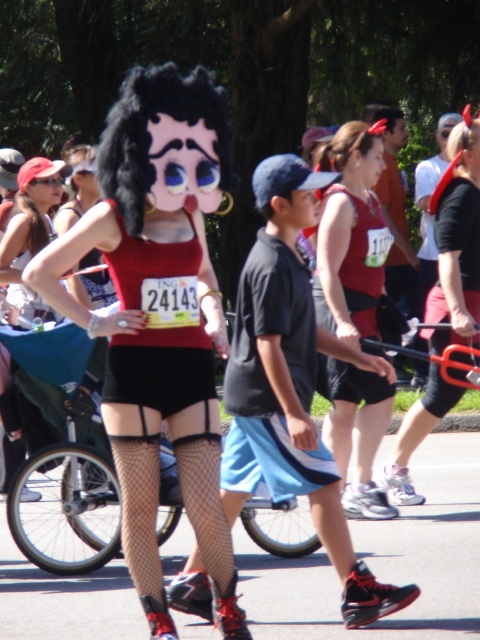
You are standing at the event and want to take a photo of the matte black wig at center. If your camera can focus up to 20 feet away, will you be able to capture it clearly?

The matte black wig at center is 18.37 feet away from the viewer. Since the camera can focus up to 20 feet, it is within range, so yes, you can capture it clearly.

You are a photographer at the event and want to capture a clear photo of the black mesh shorts at center without the matte black wig at center blocking it. Can you adjust your angle to do so?

The matte black wig at center is in front of the black mesh shorts at center, so you would need to adjust your angle to capture the black mesh shorts at center without the matte black wig at center blocking it.